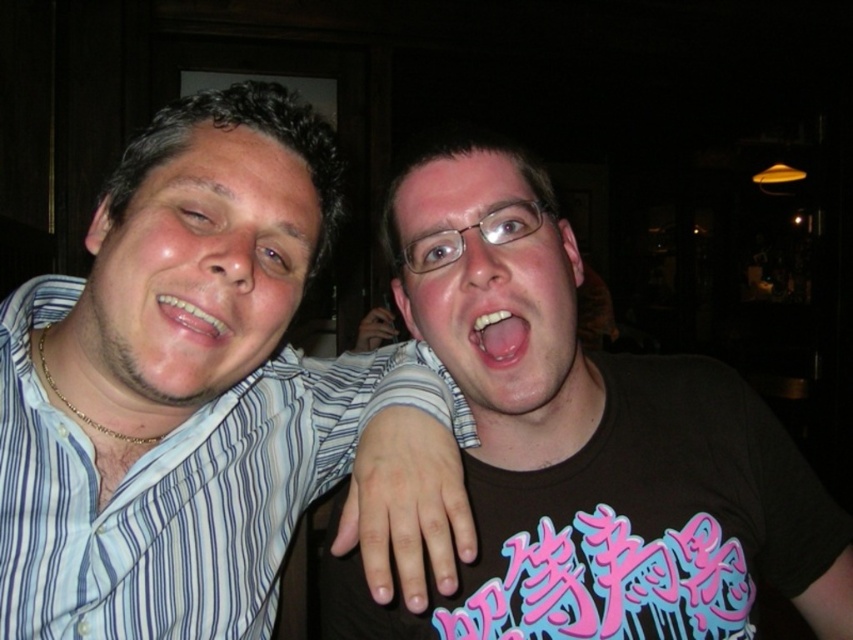
Question: Can you confirm if matte striped shirt at left is thinner than glossy white teeth at center?

Choices:
 (A) no
 (B) yes

Answer: (A)

Question: Is blue striped shirt at left bigger than pink glossy mouth at center?

Choices:
 (A) no
 (B) yes

Answer: (B)

Question: Considering the relative positions of blue striped shirt at left and matte striped shirt at left in the image provided, where is blue striped shirt at left located with respect to matte striped shirt at left?

Choices:
 (A) above
 (B) below

Answer: (B)

Question: Which of the following is the farthest from the observer?

Choices:
 (A) matte black face at center
 (B) matte striped shirt at left

Answer: (A)

Question: Which is nearer to the black matte t-shirt at center?

Choices:
 (A) matte black face at center
 (B) glossy white teeth at center

Answer: (A)

Question: Which point is farther from the camera taking this photo?

Choices:
 (A) (13, 598)
 (B) (683, 449)

Answer: (B)